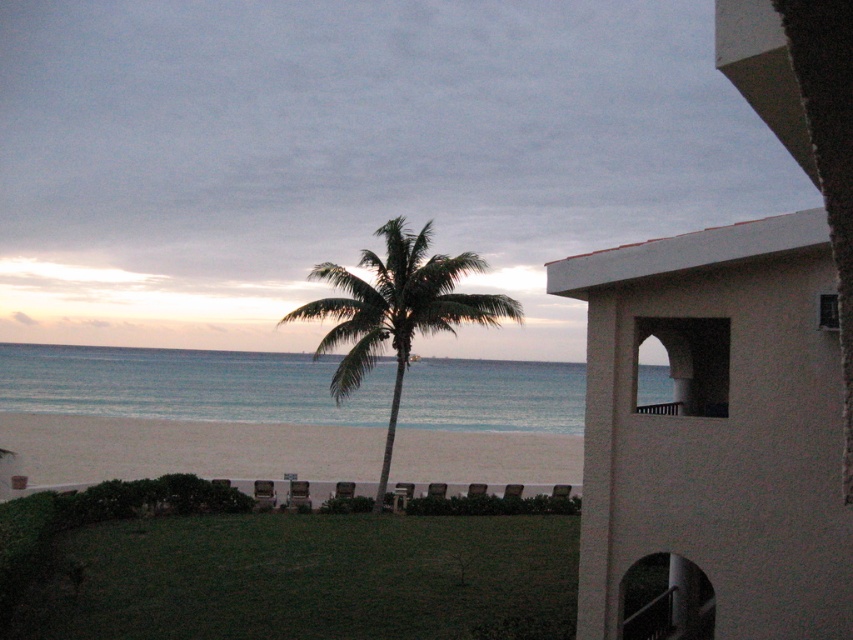
Which of these two, white sand beach at lower center or green leafy palm tree at center, stands shorter?

Standing shorter between the two is white sand beach at lower center.

Is point (492, 476) closer to viewer compared to point (439, 326)?

No, (492, 476) is further to viewer.

Where is `white sand beach at lower center`? The height and width of the screenshot is (640, 853). white sand beach at lower center is located at coordinates (184, 451).

Is white stucco building at right smaller than blue water at center?

Yes.

Does white stucco building at right appear on the right side of blue water at center?

Yes, white stucco building at right is to the right of blue water at center.

Is point (782, 136) farther from viewer compared to point (494, 419)?

No, it is in front of (494, 419).

I want to click on white stucco building at right, so click(x=718, y=428).

Is point (490, 369) more distant than point (461, 314)?

Yes, it is behind point (461, 314).

Is point (534, 424) closer to viewer compared to point (387, 308)?

No, it is behind (387, 308).

The image size is (853, 640). I want to click on blue water at center, so click(x=186, y=385).